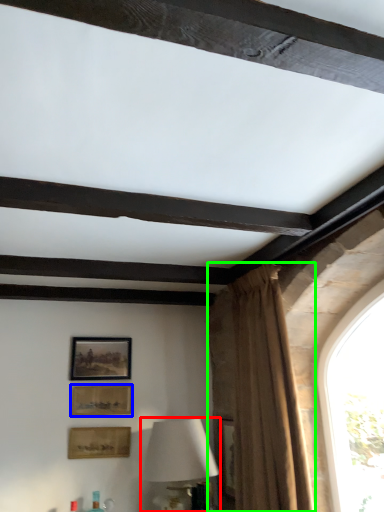
Question: Which is farther away from table lamp (highlighted by a red box)? picture frame (highlighted by a blue box) or curtain (highlighted by a green box)?

Choices:
 (A) picture frame
 (B) curtain

Answer: (B)